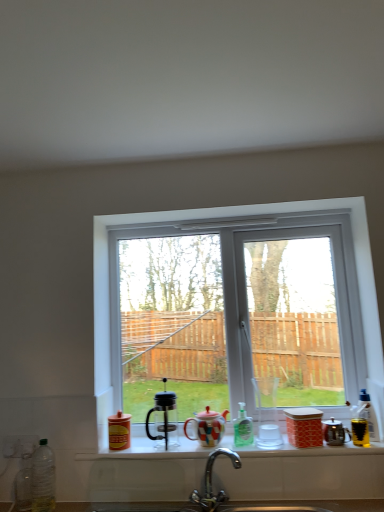
Question: Visually, is metallic silver kettle at right, which is the second appliance from left to right, positioned to the left or to the right of metallic gold cup at right, arranged as the 1th appliance when viewed from the right?

Choices:
 (A) right
 (B) left

Answer: (B)

Question: Is metallic silver kettle at right, which is the second appliance from left to right, bigger or smaller than metallic gold cup at right, arranged as the 1th appliance when viewed from the right?

Choices:
 (A) big
 (B) small

Answer: (A)

Question: Which is farther from the matte glass window sill at center?

Choices:
 (A) white glossy sink at lower center
 (B) yellow plastic bottle at right, which appears as the third bottle when viewed from the left
 (C) polished chrome faucet at lower center
 (D) matte ceramic teapot at center
 (E) white plastic window at center

Answer: (E)

Question: Which object is positioned closest to the white glossy sink at lower center?

Choices:
 (A) white plastic window at center
 (B) matte ceramic teapot at center
 (C) metallic gold cup at right, the 3th appliance viewed from the left
 (D) matte glass window sill at center
 (E) clear plastic bottle at lower left, the 3th bottle when ordered from right to left

Answer: (C)